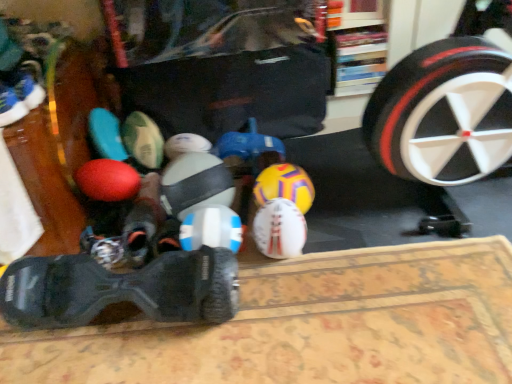
Question: Could black rubber remote control at lower left, which ranks as the 2th footwear in left-to-right order, be considered to be inside white matte soccer ball at center, the 1th toy in the left-to-right sequence?

Choices:
 (A) yes
 (B) no

Answer: (B)

Question: Is black rubber remote control at lower left, which appears as the second footwear when viewed from the top, at the back of white matte soccer ball at center, the 1th toy in the left-to-right sequence?

Choices:
 (A) no
 (B) yes

Answer: (A)

Question: Is white matte soccer ball at center, the 1th toy in the left-to-right sequence, next to black rubber remote control at lower left, which ranks as the 2th footwear in left-to-right order?

Choices:
 (A) no
 (B) yes

Answer: (A)

Question: From the image's perspective, does white matte soccer ball at center, the 1th toy in the left-to-right sequence, appear lower than black rubber remote control at lower left, marked as the first footwear in a bottom-to-top arrangement?

Choices:
 (A) yes
 (B) no

Answer: (B)

Question: Is white matte soccer ball at center, the 1th toy in the left-to-right sequence, oriented towards black rubber remote control at lower left, which ranks as the 2th footwear in left-to-right order?

Choices:
 (A) yes
 (B) no

Answer: (A)

Question: Would you say white plastic remote control at center, arranged as the 3th toy when viewed from the right, is to the left or to the right of yellow matte soccer ball at center, arranged as the 4th toy when viewed from the left, in the picture?

Choices:
 (A) right
 (B) left

Answer: (B)

Question: Considering the positions of white plastic remote control at center, arranged as the 3th toy when viewed from the right, and yellow matte soccer ball at center, arranged as the 4th toy when viewed from the left, in the image, is white plastic remote control at center, arranged as the 3th toy when viewed from the right, wider or thinner than yellow matte soccer ball at center, arranged as the 4th toy when viewed from the left,?

Choices:
 (A) wide
 (B) thin

Answer: (A)

Question: Looking at the image, does white plastic remote control at center, arranged as the 3th toy when viewed from the right, seem bigger or smaller compared to yellow matte soccer ball at center, arranged as the 4th toy when viewed from the left?

Choices:
 (A) small
 (B) big

Answer: (A)

Question: Considering their positions, is white plastic remote control at center, the 2th toy viewed from the left, located in front of or behind yellow matte soccer ball at center, which is counted as the 1th toy, starting from the right?

Choices:
 (A) behind
 (B) front

Answer: (B)

Question: In terms of height, does white plastic remote control at center, arranged as the 3th toy when viewed from the right, look taller or shorter compared to white matte soccer ball at center, arranged as the 2th toy when viewed from the right?

Choices:
 (A) tall
 (B) short

Answer: (B)

Question: Is white plastic remote control at center, arranged as the 3th toy when viewed from the right, in front of or behind white matte soccer ball at center, arranged as the 2th toy when viewed from the right, in the image?

Choices:
 (A) front
 (B) behind

Answer: (A)

Question: Looking at the image, does white plastic remote control at center, arranged as the 3th toy when viewed from the right, seem bigger or smaller compared to white matte soccer ball at center, marked as the 3th toy in a left-to-right arrangement?

Choices:
 (A) small
 (B) big

Answer: (B)

Question: From the image's perspective, is white plastic remote control at center, arranged as the 3th toy when viewed from the right, located above or below white matte soccer ball at center, marked as the 3th toy in a left-to-right arrangement?

Choices:
 (A) above
 (B) below

Answer: (B)

Question: From a real-world perspective, is yellow matte soccer ball at center, arranged as the 4th toy when viewed from the left, above or below white matte soccer ball at center, the 1th toy in the left-to-right sequence?

Choices:
 (A) above
 (B) below

Answer: (B)

Question: Looking at their shapes, would you say yellow matte soccer ball at center, which is counted as the 1th toy, starting from the right, is wider or thinner than white matte soccer ball at center, the 1th toy in the left-to-right sequence?

Choices:
 (A) wide
 (B) thin

Answer: (B)